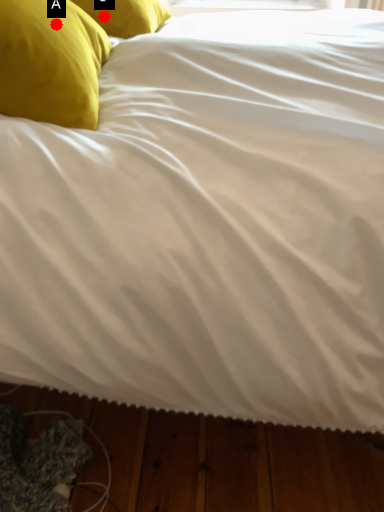
Question: Two points are circled on the image, labeled by A and B beside each circle. Which point is closer to the camera?

Choices:
 (A) A is closer
 (B) B is closer

Answer: (A)